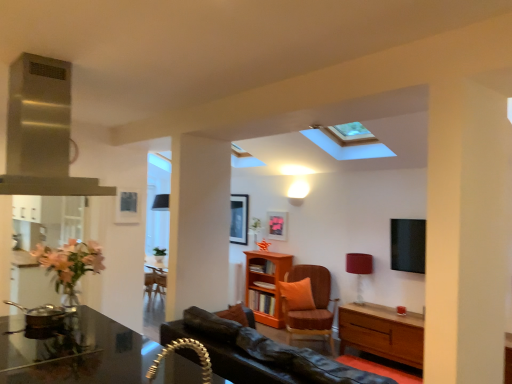
Question: Looking at the image, does matte red lampshade at right seem bigger or smaller compared to shiny black desk at lower left?

Choices:
 (A) big
 (B) small

Answer: (B)

Question: Which is correct: matte red lampshade at right is inside shiny black desk at lower left, or outside of it?

Choices:
 (A) outside
 (B) inside

Answer: (A)

Question: Based on their relative distances, which object is farther from the matte red lampshade at right?

Choices:
 (A) orange textured cushion at center
 (B) shiny black desk at lower left
 (C) wooden bookshelf at center
 (D) stainless steel exhaust hood at upper left
 (E) orange fabric pillow at center

Answer: (D)

Question: Considering the real-world distances, which object is closest to the orange fabric pillow at center?

Choices:
 (A) stainless steel exhaust hood at upper left
 (B) wooden bookshelf at center
 (C) orange textured cushion at center
 (D) matte pink picture frame at center
 (E) matte red lampshade at right

Answer: (C)